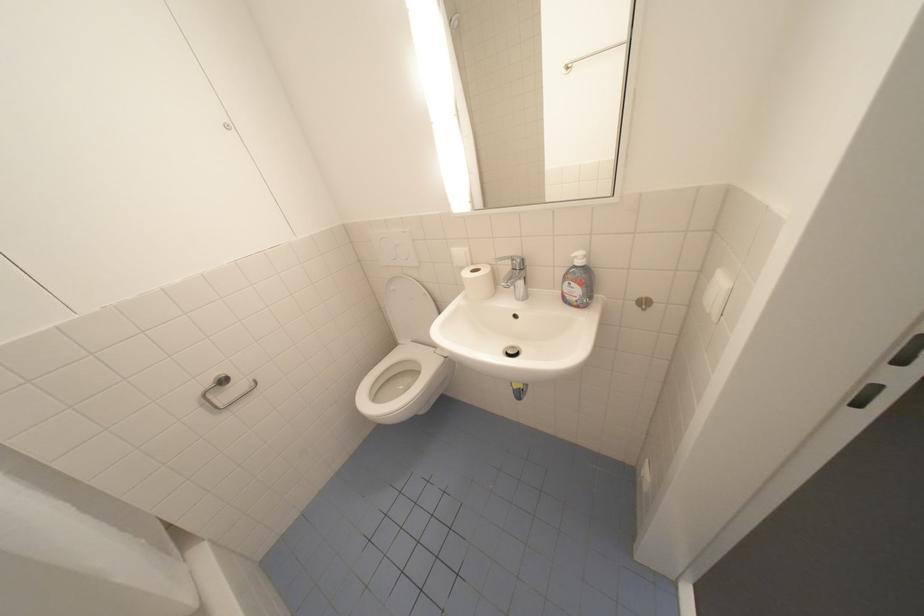
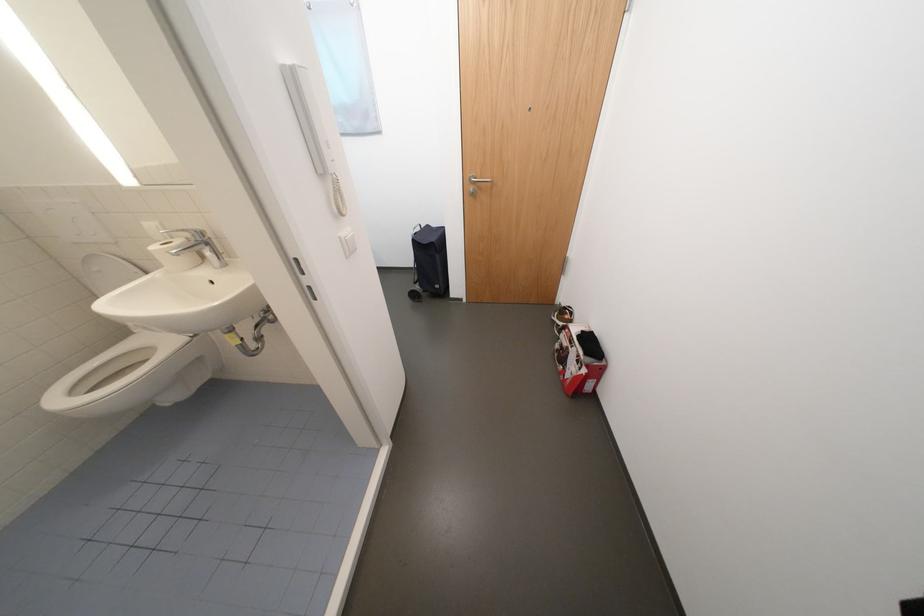
In the second image, find the point that corresponds to (407,342) in the first image.

(142, 333)